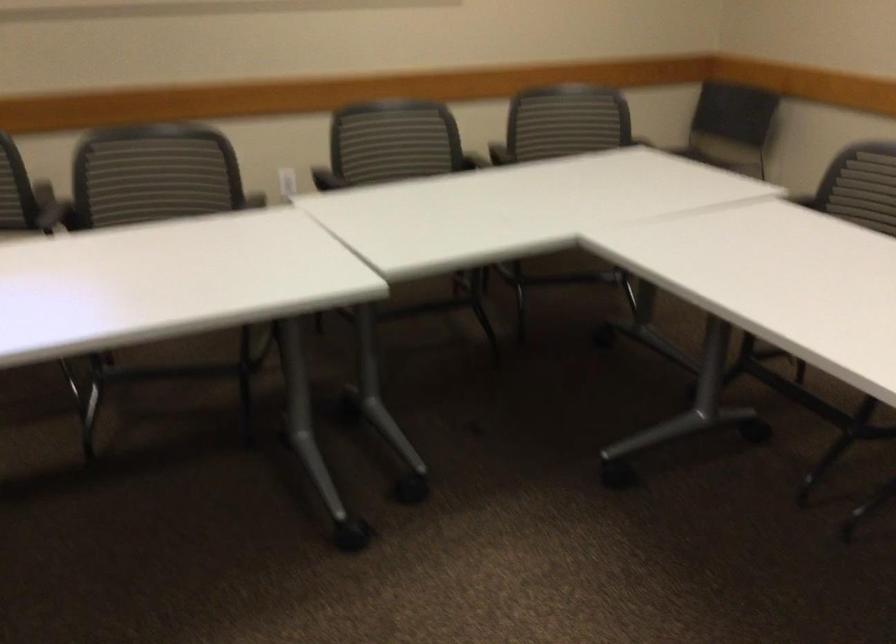
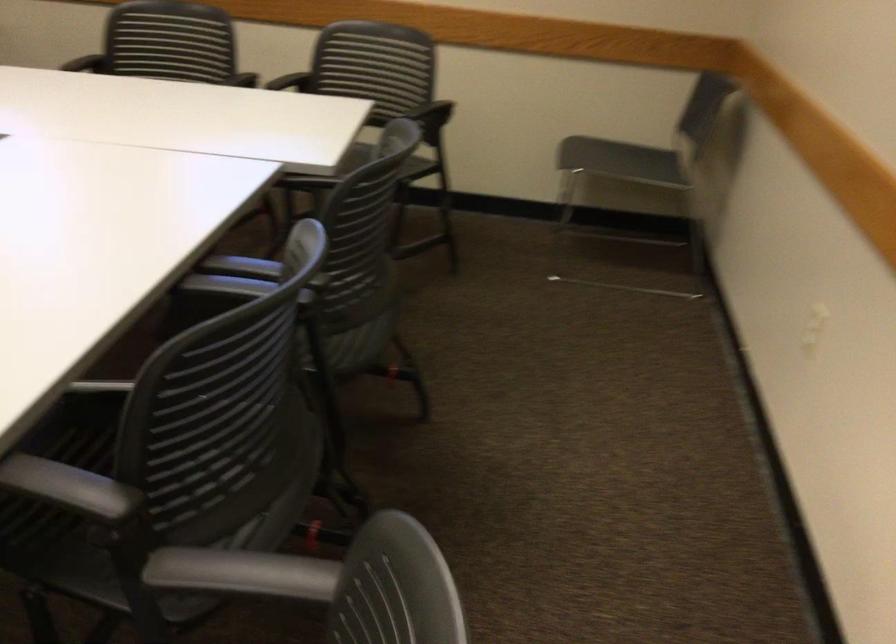
In the second image, find the point that corresponds to pixel 376 160 in the first image.

(300, 75)